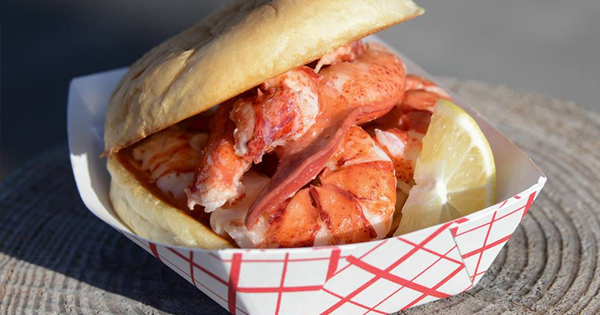
I want to click on plate, so click(577, 201).